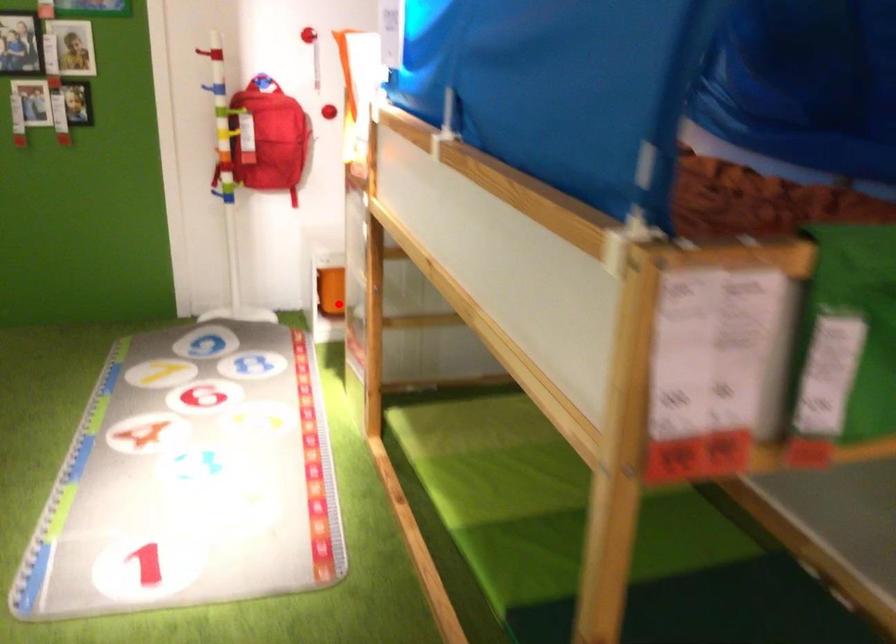
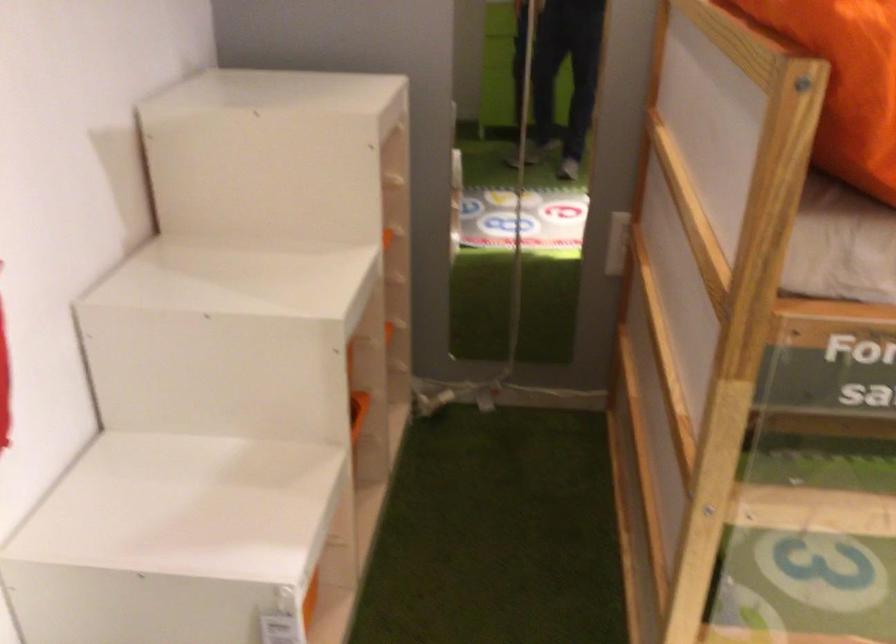
Question: I am providing you with two images of the same scene from different viewpoints. A red point is marked on the first image. At the location where the point appears in image 1, is it still visible in image 2?

Choices:
 (A) Yes
 (B) No

Answer: (A)